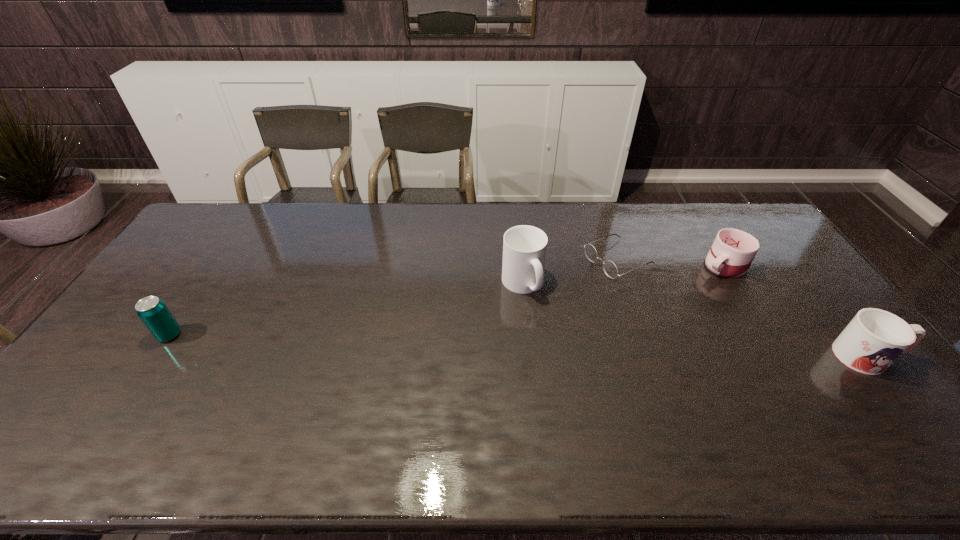
Locate an element on the screen. The image size is (960, 540). vacant spot on the desktop that is between the beer can and the rightmost mug and is positioned on the handle side of the tallest object is located at coordinates (586, 347).

You are a GUI agent. You are given a task and a screenshot of the screen. Output one action in this format:
    pyautogui.click(x=<x>, y=<y>)
    Task: Click on the free space on the desktop that is between the leftmost object and the rightmost mug and is positioned on the side with the handle of the second mug from left to right
    
    Given the screenshot: What is the action you would take?
    pyautogui.click(x=584, y=347)

Locate an element on the screen. vacant space on the desktop that is between the beer can and the rightmost object and is positioned on the front-facing side of the spectacles is located at coordinates (429, 343).